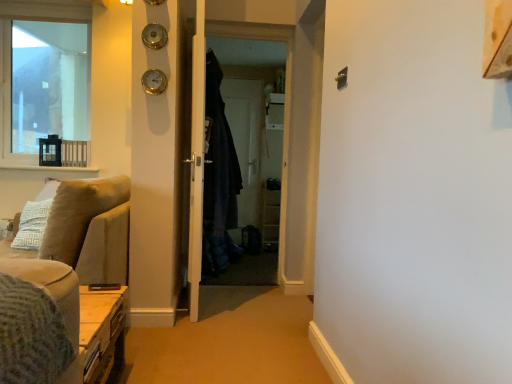
Question: Can you confirm if beige fabric couch at left is wider than dark fabric screen door at center, which is the 2th screen door from back to front?

Choices:
 (A) no
 (B) yes

Answer: (B)

Question: Considering the relative sizes of beige fabric couch at left and dark fabric screen door at center, which appears as the first screen door when viewed from the front, in the image provided, is beige fabric couch at left bigger than dark fabric screen door at center, which appears as the first screen door when viewed from the front,?

Choices:
 (A) no
 (B) yes

Answer: (B)

Question: Is beige fabric couch at left smaller than dark fabric screen door at center, which appears as the first screen door when viewed from the front?

Choices:
 (A) yes
 (B) no

Answer: (B)

Question: Is the depth of beige fabric couch at left greater than that of dark fabric screen door at center, which appears as the first screen door when viewed from the front?

Choices:
 (A) yes
 (B) no

Answer: (B)

Question: Can you confirm if beige fabric couch at left is positioned to the right of dark fabric screen door at center, which is the 2th screen door from back to front?

Choices:
 (A) no
 (B) yes

Answer: (A)

Question: Based on their positions, is white wood door at center located to the left or right of dark fabric screen door at center, which is the 2th screen door from back to front?

Choices:
 (A) right
 (B) left

Answer: (B)

Question: From the image's perspective, is white wood door at center positioned above or below dark fabric screen door at center, which appears as the first screen door when viewed from the front?

Choices:
 (A) below
 (B) above

Answer: (A)

Question: Considering the positions of white wood door at center and dark fabric screen door at center, which appears as the first screen door when viewed from the front, in the image, is white wood door at center wider or thinner than dark fabric screen door at center, which appears as the first screen door when viewed from the front,?

Choices:
 (A) thin
 (B) wide

Answer: (A)

Question: Considering the positions of white wood door at center and dark fabric screen door at center, which is the 2th screen door from back to front, in the image, is white wood door at center taller or shorter than dark fabric screen door at center, which is the 2th screen door from back to front,?

Choices:
 (A) short
 (B) tall

Answer: (B)

Question: Would you say dark blue fabric robe at center is to the left or to the right of green knitted blanket at lower left in the picture?

Choices:
 (A) right
 (B) left

Answer: (A)

Question: From the image's perspective, relative to green knitted blanket at lower left, is dark blue fabric robe at center above or below?

Choices:
 (A) below
 (B) above

Answer: (B)

Question: Looking at their shapes, would you say dark blue fabric robe at center is wider or thinner than green knitted blanket at lower left?

Choices:
 (A) wide
 (B) thin

Answer: (A)

Question: From a real-world perspective, is dark blue fabric robe at center above or below green knitted blanket at lower left?

Choices:
 (A) above
 (B) below

Answer: (A)

Question: In the image, is dark blue fabric robe at center on the left side or the right side of white wood shelving unit at center?

Choices:
 (A) right
 (B) left

Answer: (B)

Question: Looking at their shapes, would you say dark blue fabric robe at center is wider or thinner than white wood shelving unit at center?

Choices:
 (A) wide
 (B) thin

Answer: (B)